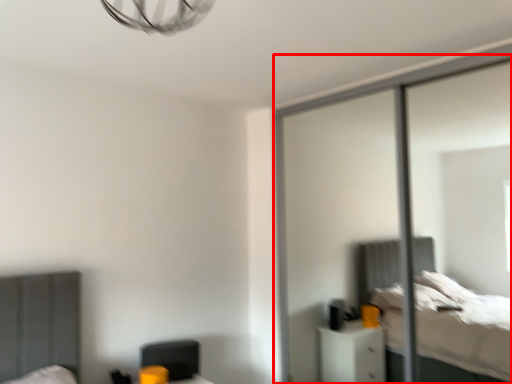
Question: From the image's perspective, what is the correct spatial positioning of screen door (annotated by the red box) in reference to swivel chair?

Choices:
 (A) above
 (B) below

Answer: (A)